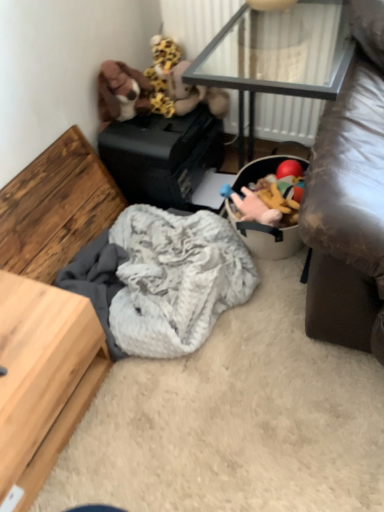
Identify the location of soft plush toy at center, the 4th toy from the left. (253, 207).

Where is `fuzzy fabric stuffed animal at upper center, arranged as the third toy when viewed from the right`? The height and width of the screenshot is (512, 384). fuzzy fabric stuffed animal at upper center, arranged as the third toy when viewed from the right is located at coordinates (178, 83).

Describe the element at coordinates (253, 201) in the screenshot. The height and width of the screenshot is (512, 384). I see `soft plush toys at center` at that location.

Image resolution: width=384 pixels, height=512 pixels. Identify the location of fluffy yellow and brown stuffed animal at upper center, the fourth toy viewed from the right. (162, 73).

What is the approximate width of fluffy yellow and brown stuffed animal at upper center, the fourth toy viewed from the right?

fluffy yellow and brown stuffed animal at upper center, the fourth toy viewed from the right, is 4.35 inches wide.

This screenshot has width=384, height=512. I want to click on soft plush toy at center, which appears as the 2th toy when viewed from the right, so click(x=253, y=207).

Looking at this image, can you tell me how much fluffy yellow and brown stuffed animal at upper center, the second toy when ordered from left to right, and fuzzy fabric stuffed animal at upper center, arranged as the third toy when viewed from the right, differ in facing direction?

0.00148 degrees separate the facing orientations of fluffy yellow and brown stuffed animal at upper center, the second toy when ordered from left to right, and fuzzy fabric stuffed animal at upper center, arranged as the third toy when viewed from the right.

Based on the photo, could you tell me if fluffy yellow and brown stuffed animal at upper center, the fourth toy viewed from the right, is turned towards fuzzy fabric stuffed animal at upper center, which appears as the 3th toy when viewed from the left?

No, fluffy yellow and brown stuffed animal at upper center, the fourth toy viewed from the right, is not oriented towards fuzzy fabric stuffed animal at upper center, which appears as the 3th toy when viewed from the left.

From a real-world perspective, which is physically above, fluffy yellow and brown stuffed animal at upper center, the fourth toy viewed from the right, or fuzzy fabric stuffed animal at upper center, arranged as the third toy when viewed from the right?

fluffy yellow and brown stuffed animal at upper center, the fourth toy viewed from the right.

Considering the positions of objects fluffy yellow and brown stuffed animal at upper center, the second toy when ordered from left to right, and fuzzy fabric stuffed animal at upper center, which appears as the 3th toy when viewed from the left, in the image provided, who is behind, fluffy yellow and brown stuffed animal at upper center, the second toy when ordered from left to right, or fuzzy fabric stuffed animal at upper center, which appears as the 3th toy when viewed from the left,?

fluffy yellow and brown stuffed animal at upper center, the second toy when ordered from left to right, is behind.

From the image's perspective, is brown plush toy at upper left, the fifth toy from the right, above or below soft plush toys at center?

From the image's perspective, brown plush toy at upper left, the fifth toy from the right, appears above soft plush toys at center.

Is point (101, 113) positioned behind point (282, 199)?

Yes, it is.

Is soft plush toys at center at the back of brown plush toy at upper left, arranged as the 1th toy when viewed from the left?

No, brown plush toy at upper left, arranged as the 1th toy when viewed from the left, is not facing the opposite direction of soft plush toys at center.

Between brown plush toy at upper left, the fifth toy from the right, and soft plush toys at center, which one has smaller width?

brown plush toy at upper left, the fifth toy from the right, is thinner.

Between brown plush toy at upper left, arranged as the 1th toy when viewed from the left, and fuzzy fabric stuffed animal at upper center, which appears as the 3th toy when viewed from the left, which one has smaller width?

Thinner between the two is brown plush toy at upper left, arranged as the 1th toy when viewed from the left.

There is a brown plush toy at upper left, arranged as the 1th toy when viewed from the left. Where is `the 2nd toy below it (from a real-world perspective)`? the 2nd toy below it (from a real-world perspective) is located at coordinates (178, 83).

Consider the image. Is brown plush toy at upper left, the fifth toy from the right, looking in the opposite direction of fuzzy fabric stuffed animal at upper center, arranged as the third toy when viewed from the right?

That's not correct — brown plush toy at upper left, the fifth toy from the right, is not looking away from fuzzy fabric stuffed animal at upper center, arranged as the third toy when viewed from the right.

Are brown plush toy at upper left, the fifth toy from the right, and fuzzy fabric stuffed animal at upper center, which appears as the 3th toy when viewed from the left, far apart?

No.

Can you confirm if fuzzy gray blanket at center is taller than transparent glass table at upper center?

No.

Considering the sizes of objects fuzzy gray blanket at center and transparent glass table at upper center in the image provided, who is wider, fuzzy gray blanket at center or transparent glass table at upper center?

Wider between the two is fuzzy gray blanket at center.

Could you tell me if fuzzy gray blanket at center is facing transparent glass table at upper center?

No, fuzzy gray blanket at center is not aimed at transparent glass table at upper center.

Relative to transparent glass table at upper center, is fuzzy gray blanket at center in front or behind?

Clearly, fuzzy gray blanket at center is in front of transparent glass table at upper center.

Consider the image. Considering the positions of objects rubber ball at center, which appears as the first toy when viewed from the right, and fuzzy fabric stuffed animal at upper center, arranged as the third toy when viewed from the right, in the image provided, who is more to the left, rubber ball at center, which appears as the first toy when viewed from the right, or fuzzy fabric stuffed animal at upper center, arranged as the third toy when viewed from the right,?

From the viewer's perspective, fuzzy fabric stuffed animal at upper center, arranged as the third toy when viewed from the right, appears more on the left side.

Identify the location of the 1st toy below the fuzzy fabric stuffed animal at upper center, which appears as the 3th toy when viewed from the left (from the image's perspective). The image size is (384, 512). (289, 169).

From the image's perspective, is rubber ball at center, which appears as the first toy when viewed from the right, over fuzzy fabric stuffed animal at upper center, arranged as the third toy when viewed from the right?

Actually, rubber ball at center, which appears as the first toy when viewed from the right, appears below fuzzy fabric stuffed animal at upper center, arranged as the third toy when viewed from the right, in the image.

From the picture: Is transparent glass table at upper center in front of rubber ball at center, which appears as the first toy when viewed from the right?

Yes, transparent glass table at upper center is in front of rubber ball at center, which appears as the first toy when viewed from the right.

Is transparent glass table at upper center not inside rubber ball at center, acting as the 5th toy starting from the left?

Yes, transparent glass table at upper center is located beyond the bounds of rubber ball at center, acting as the 5th toy starting from the left.

Which is closer, (243, 112) or (301, 166)?

Point (243, 112) is positioned farther from the camera compared to point (301, 166).

Is transparent glass table at upper center directly adjacent to rubber ball at center, which appears as the first toy when viewed from the right?

No, transparent glass table at upper center is not beside rubber ball at center, which appears as the first toy when viewed from the right.

Can fuzzy fabric stuffed animal at upper center, which appears as the 3th toy when viewed from the left, be found inside soft plush toy at center, the 4th toy from the left?

No, soft plush toy at center, the 4th toy from the left, does not contain fuzzy fabric stuffed animal at upper center, which appears as the 3th toy when viewed from the left.

Is soft plush toy at center, the 4th toy from the left, facing towards fuzzy fabric stuffed animal at upper center, which appears as the 3th toy when viewed from the left?

No, soft plush toy at center, the 4th toy from the left, is not facing towards fuzzy fabric stuffed animal at upper center, which appears as the 3th toy when viewed from the left.

From the image's perspective, is soft plush toy at center, which appears as the 2th toy when viewed from the right, located above or below fuzzy fabric stuffed animal at upper center, which appears as the 3th toy when viewed from the left?

From the image's perspective, soft plush toy at center, which appears as the 2th toy when viewed from the right, appears below fuzzy fabric stuffed animal at upper center, which appears as the 3th toy when viewed from the left.

This screenshot has height=512, width=384. I want to click on toy that is the 2nd object located behind the fuzzy fabric stuffed animal at upper center, which appears as the 3th toy when viewed from the left, so click(162, 73).

You are a GUI agent. You are given a task and a screenshot of the screen. Output one action in this format:
    pyautogui.click(x=<x>, y=<y>)
    Task: Click on the stuff below the brown plush toy at upper left, the fifth toy from the right (from the image's perspective)
    
    Given the screenshot: What is the action you would take?
    pyautogui.click(x=253, y=201)

Which object lies nearer to the anchor point transparent glass table at upper center, soft plush toy at center, which appears as the 2th toy when viewed from the right, or fuzzy gray blanket at center?

The object closer to transparent glass table at upper center is soft plush toy at center, which appears as the 2th toy when viewed from the right.

Which object lies further to the anchor point soft plush toy at center, which appears as the 2th toy when viewed from the right, fuzzy gray blanket at center or fluffy yellow and brown stuffed animal at upper center, the fourth toy viewed from the right?

Among the two, fluffy yellow and brown stuffed animal at upper center, the fourth toy viewed from the right, is located further to soft plush toy at center, which appears as the 2th toy when viewed from the right.

Looking at the image, which one is located closer to soft plush toy at center, which appears as the 2th toy when viewed from the right, rubber ball at center, which appears as the first toy when viewed from the right, or fluffy yellow and brown stuffed animal at upper center, the second toy when ordered from left to right?

The object closer to soft plush toy at center, which appears as the 2th toy when viewed from the right, is rubber ball at center, which appears as the first toy when viewed from the right.

When comparing their distances from fuzzy gray blanket at center, does fuzzy fabric stuffed animal at upper center, which appears as the 3th toy when viewed from the left, or soft plush toys at center seem further?

fuzzy fabric stuffed animal at upper center, which appears as the 3th toy when viewed from the left, is positioned further to the anchor fuzzy gray blanket at center.

Based on their spatial positions, is brown plush toy at upper left, the fifth toy from the right, or fluffy yellow and brown stuffed animal at upper center, the fourth toy viewed from the right, further from soft plush toys at center?

Among the two, brown plush toy at upper left, the fifth toy from the right, is located further to soft plush toys at center.

From the image, which object appears to be nearer to soft plush toy at center, which appears as the 2th toy when viewed from the right, soft plush toys at center or rubber ball at center, which appears as the first toy when viewed from the right?

soft plush toys at center lies closer to soft plush toy at center, which appears as the 2th toy when viewed from the right, than the other object.

Estimate the real-world distances between objects in this image. Which object is further from transparent glass table at upper center, fluffy yellow and brown stuffed animal at upper center, the second toy when ordered from left to right, or soft plush toy at center, the 4th toy from the left?

soft plush toy at center, the 4th toy from the left.

Considering their positions, is transparent glass table at upper center positioned further to soft plush toy at center, the 4th toy from the left, than fuzzy fabric stuffed animal at upper center, which appears as the 3th toy when viewed from the left?

transparent glass table at upper center lies further to soft plush toy at center, the 4th toy from the left, than the other object.

What are the coordinates of `stuff situated between fuzzy gray blanket at center and rubber ball at center, which appears as the first toy when viewed from the right, from left to right` in the screenshot? It's located at (253, 201).

The image size is (384, 512). What are the coordinates of `table between fluffy yellow and brown stuffed animal at upper center, the second toy when ordered from left to right, and rubber ball at center, acting as the 5th toy starting from the left, in the horizontal direction` in the screenshot? It's located at pos(277,56).

At what (x,y) coordinates should I click in order to perform the action: click on stuff between fuzzy fabric stuffed animal at upper center, arranged as the third toy when viewed from the right, and fuzzy gray blanket at center in the up-down direction. Please return your answer as a coordinate pair (x, y). The height and width of the screenshot is (512, 384). Looking at the image, I should click on (253, 201).

At what (x,y) coordinates should I click in order to perform the action: click on stuff between brown plush toy at upper left, arranged as the 1th toy when viewed from the left, and rubber ball at center, acting as the 5th toy starting from the left, in the horizontal direction. Please return your answer as a coordinate pair (x, y). Image resolution: width=384 pixels, height=512 pixels. Looking at the image, I should click on (253, 201).